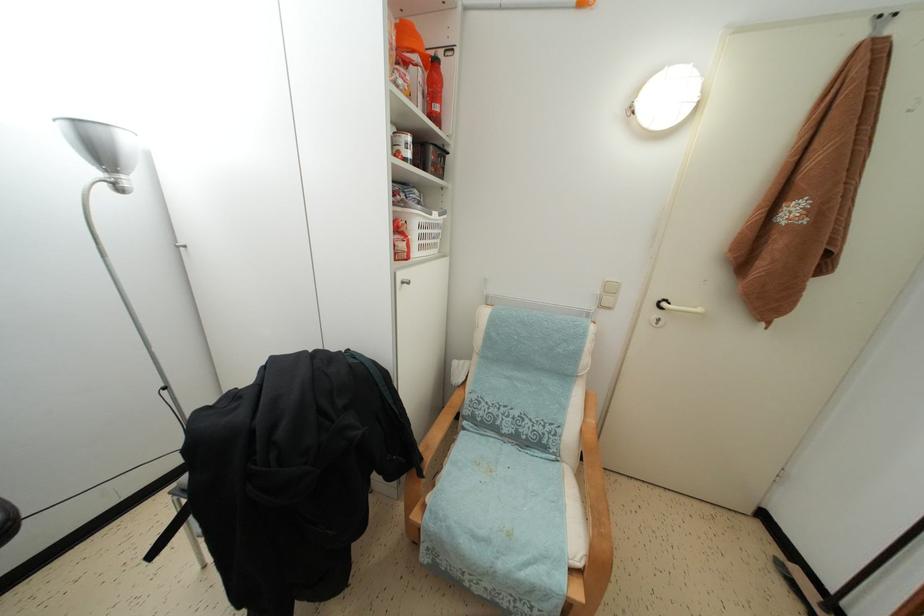
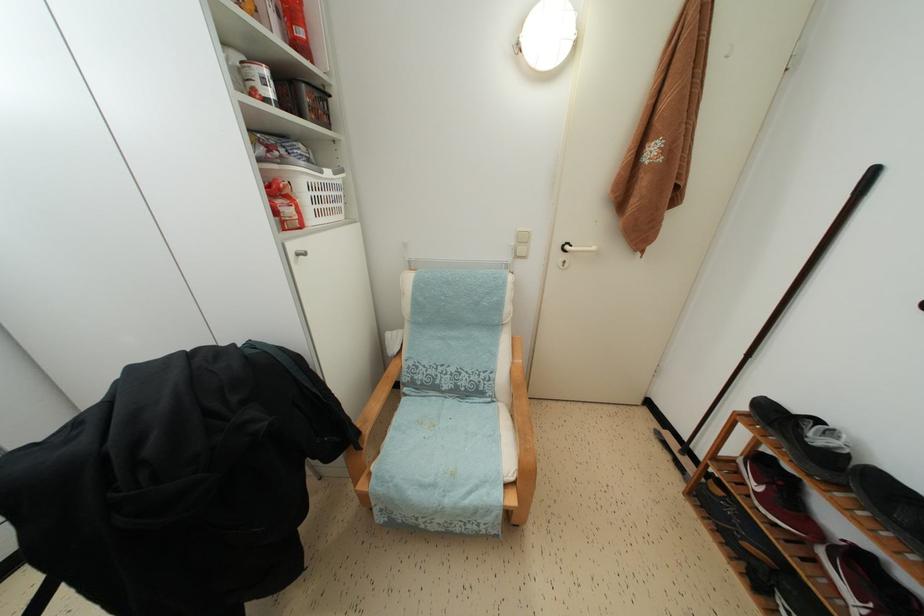
The point at (667,310) is marked in the first image. Where is the corresponding point in the second image?

(572, 253)